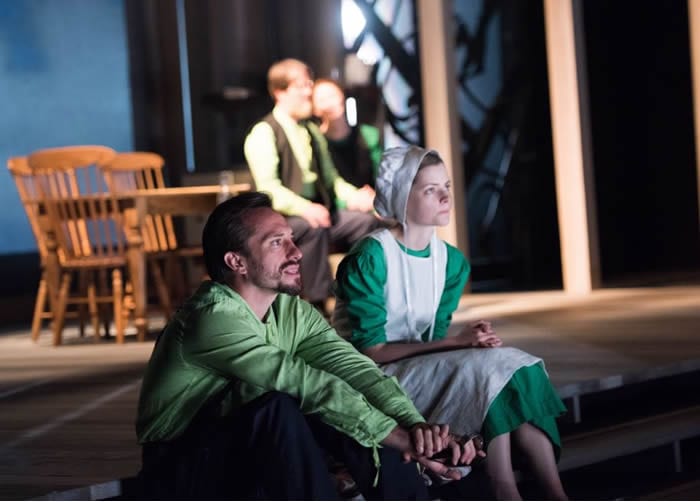
Identify the location of stage floor. Image resolution: width=700 pixels, height=502 pixels. (592, 313).